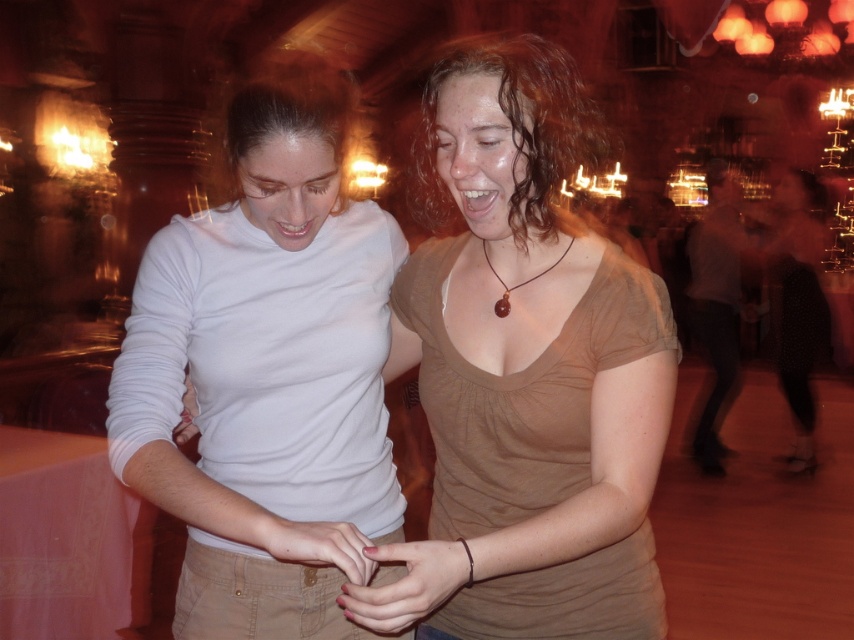
In the scene shown: Does light gray shirt at right appear under smooth skin hand at center?

Incorrect, light gray shirt at right is not positioned below smooth skin hand at center.

Is light gray shirt at right to the right of smooth skin hand at center from the viewer's perspective?

Yes, light gray shirt at right is to the right of smooth skin hand at center.

Measure the distance between light gray shirt at right and camera.

The distance of light gray shirt at right from camera is 17.88 feet.

What are the coordinates of `light gray shirt at right` in the screenshot? It's located at (717, 307).

Which is more to the left, brown matte shirt at center or matte white hand at lower left?

matte white hand at lower left is more to the left.

Does brown matte shirt at center appear under matte white hand at lower left?

No, brown matte shirt at center is not below matte white hand at lower left.

Which is behind, point (588, 289) or point (196, 424)?

The point (196, 424) is more distant.

Find the location of a particular element. Image resolution: width=854 pixels, height=640 pixels. brown matte shirt at center is located at coordinates (525, 372).

Is matte pink nails at center smaller than brown wooden pendant at center?

Actually, matte pink nails at center might be larger than brown wooden pendant at center.

Which is behind, point (428, 595) or point (496, 310)?

Positioned behind is point (496, 310).

Does point (414, 596) lie behind point (488, 262)?

No, it is not.

Where is `matte pink nails at center`? matte pink nails at center is located at coordinates (407, 584).